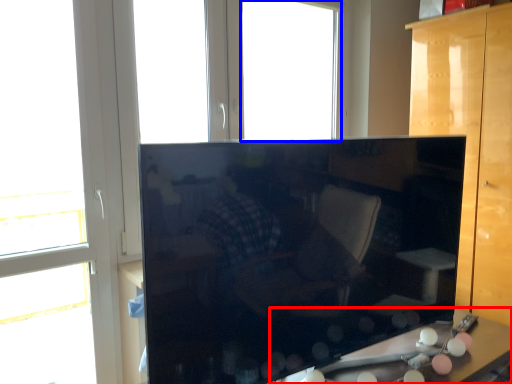
Question: Which object appears farthest to the camera in this image, table (highlighted by a red box) or window (highlighted by a blue box)?

Choices:
 (A) table
 (B) window

Answer: (B)